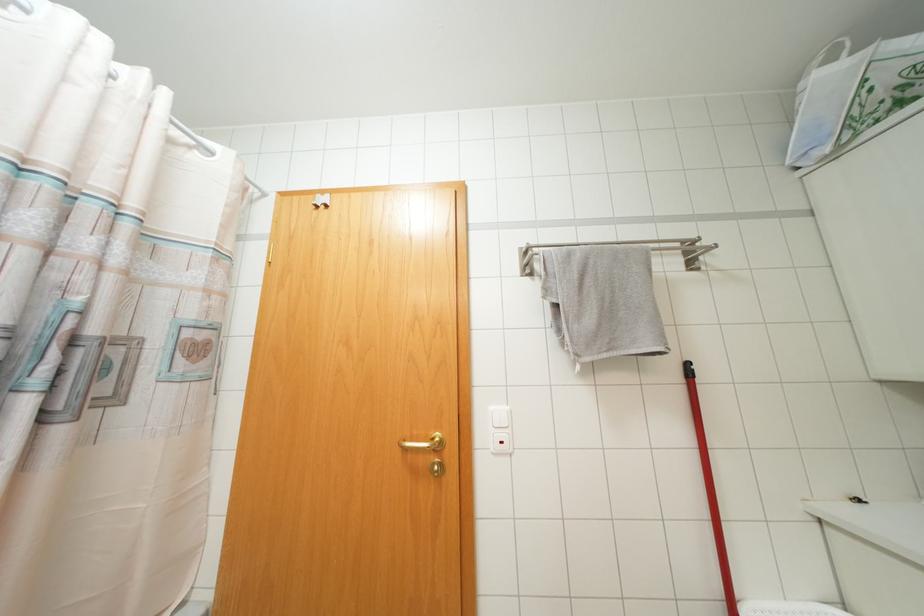
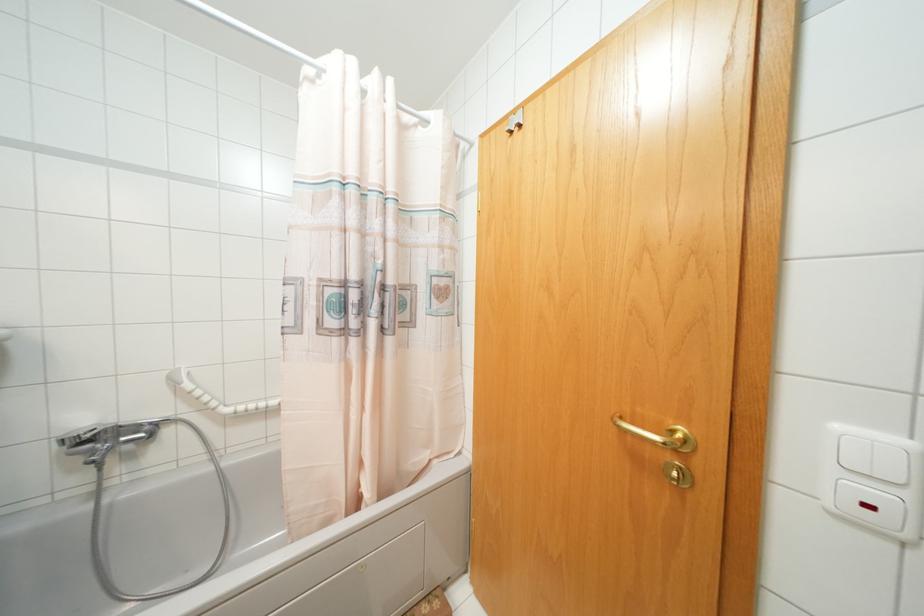
The point at (440, 440) is marked in the first image. Where is the corresponding point in the second image?

(686, 440)